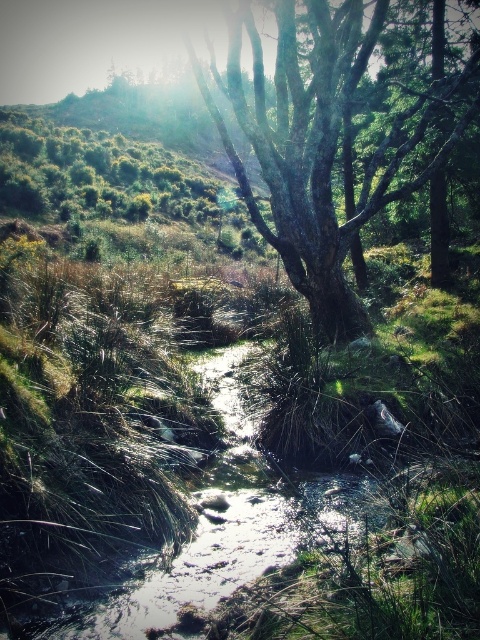
A hiker wants to cross the stream to reach the smooth bark tree at center. The stream is 1.5 meters wide. Can the hiker cross the stream without getting their feet wet?

The stream is 1.5 meters wide, so the hiker can cross the stream without getting their feet wet by stepping on the rocks visible beneath the surface.

You are a hiker who wants to cross the stream. You see the smooth bark tree at center and the clear water at stream center. Which object is closer to you, and why?

The smooth bark tree at center is closer to you because it is positioned further to the viewer than the clear water at stream center, meaning it appears nearer in the scene.

You are a hiker who wants to cross the stream. You have a 7 meter long rope. If you tie one end of the rope to the smooth bark tree at center, can you reach the clear water at stream center with the other end?

The distance between the smooth bark tree at center and the clear water at stream center is 7.19 meters. Since the rope is only 7 meters long, it is 0.19 meters short. Therefore, you cannot reach the clear water at stream center with the rope.